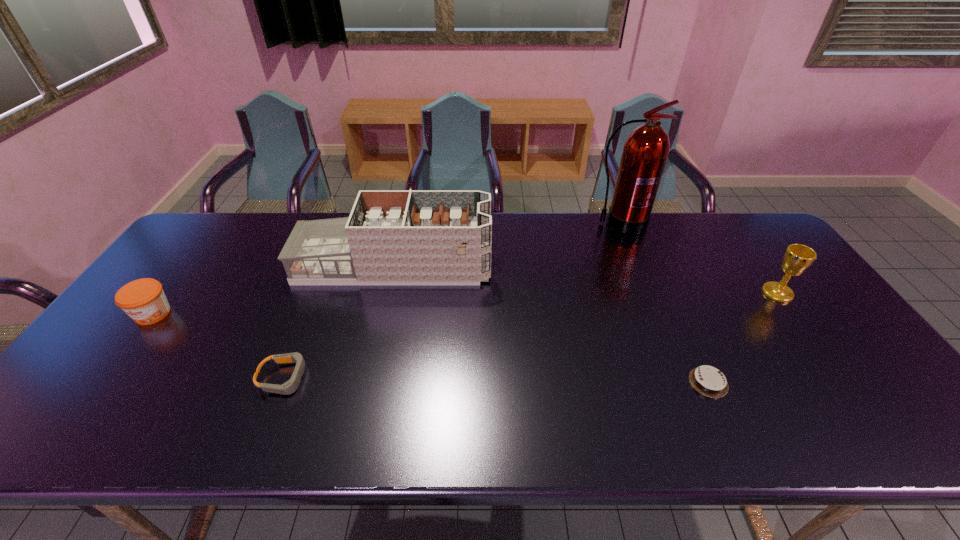
Where is `blank space at the near edge of the desktop`? This screenshot has width=960, height=540. blank space at the near edge of the desktop is located at coordinates (205, 415).

Where is `vacant space at the left edge of the desktop`? This screenshot has height=540, width=960. vacant space at the left edge of the desktop is located at coordinates (135, 336).

You are a GUI agent. You are given a task and a screenshot of the screen. Output one action in this format:
    pyautogui.click(x=<x>, y=<y>)
    Task: Click on the vacant area at the right edge of the desktop
    This screenshot has width=960, height=540.
    Given the screenshot: What is the action you would take?
    pyautogui.click(x=856, y=372)

Locate an element on the screen. The height and width of the screenshot is (540, 960). free space at the far right corner of the desktop is located at coordinates (730, 234).

I want to click on free point between the fourth tallest object and the chocolate cake, so click(431, 348).

This screenshot has width=960, height=540. Identify the location of unoccupied position between the leftmost object and the chocolate cake. (431, 348).

Locate an element on the screen. The image size is (960, 540). blank region between the second shortest object and the farthest object is located at coordinates (452, 301).

Find the location of a particular element. free area in between the third shortest object and the rightmost object is located at coordinates (466, 303).

Locate an element on the screen. The width and height of the screenshot is (960, 540). free space between the dollhouse and the leftmost object is located at coordinates (274, 290).

Where is `free point between the third shortest object and the second tallest object`? This screenshot has height=540, width=960. free point between the third shortest object and the second tallest object is located at coordinates (274, 290).